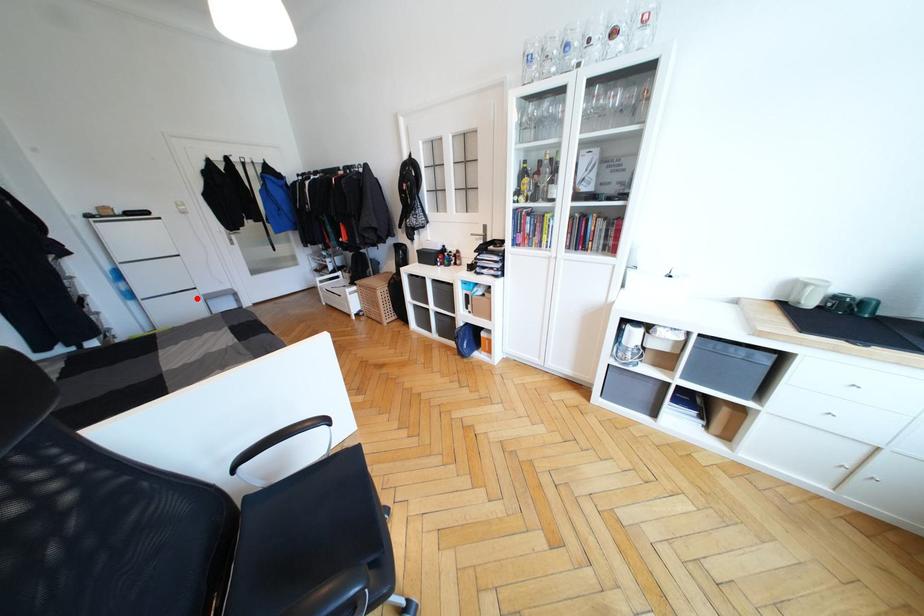
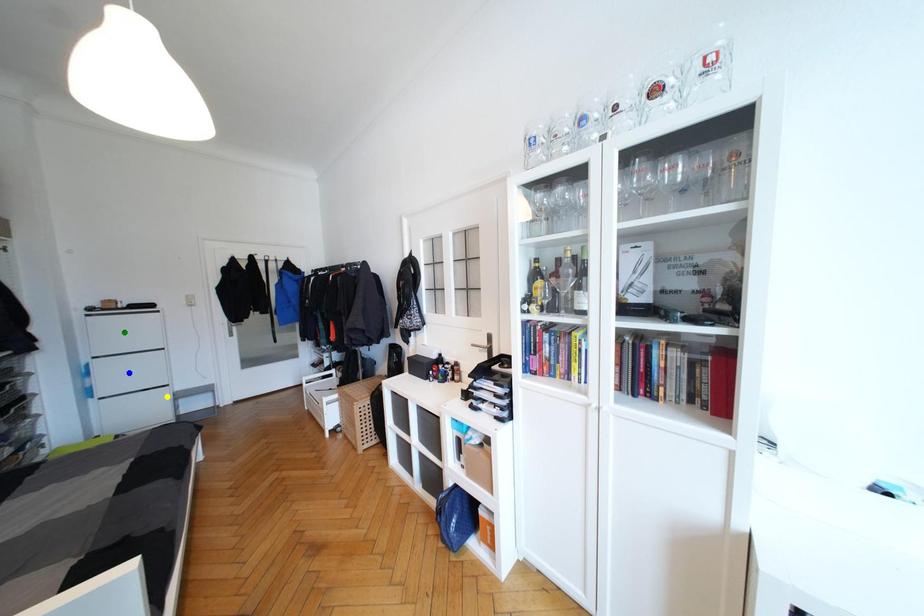
Question: I am providing you with two images of the same scene from different viewpoints. A red point is marked on the first image. You are given multiple points on the second image. Which point in image 2 is actually the same real-world point as the red point in image 1?

Choices:
 (A) blue point
 (B) yellow point
 (C) green point

Answer: (B)